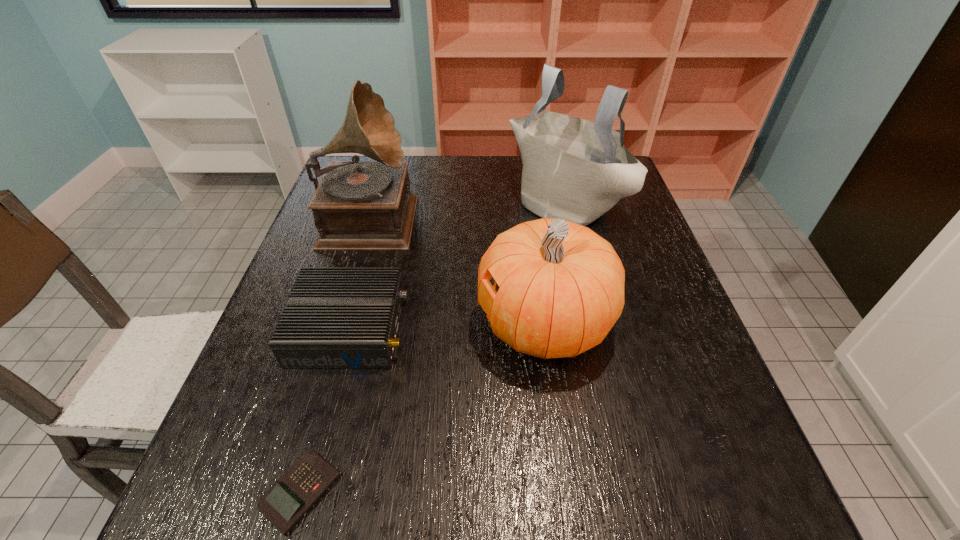
Identify the location of object located at the far left corner. (358, 205).

Where is `object at the near left corner`? object at the near left corner is located at coordinates (298, 489).

You are a GUI agent. You are given a task and a screenshot of the screen. Output one action in this format:
    pyautogui.click(x=<x>, y=<y>)
    Task: Click on the object located in the far right corner section of the desktop
    The height and width of the screenshot is (540, 960).
    Given the screenshot: What is the action you would take?
    pyautogui.click(x=573, y=169)

The width and height of the screenshot is (960, 540). I want to click on vacant space at the far edge, so click(475, 161).

Locate an element on the screen. This screenshot has height=540, width=960. vacant space at the left edge of the desktop is located at coordinates (226, 430).

In the image, there is a desktop. Identify the location of vacant region at the right edge. (637, 320).

Locate an element on the screen. vacant space in between the router and the shopping bag is located at coordinates (457, 265).

You are a GUI agent. You are given a task and a screenshot of the screen. Output one action in this format:
    pyautogui.click(x=<x>, y=<y>)
    Task: Click on the empty space that is in between the third tallest object and the calculator
    
    Given the screenshot: What is the action you would take?
    pyautogui.click(x=422, y=407)

The width and height of the screenshot is (960, 540). I want to click on vacant space that is in between the record player and the pumpkin, so click(x=457, y=269).

Locate an element on the screen. free space between the router and the nearest object is located at coordinates (325, 409).